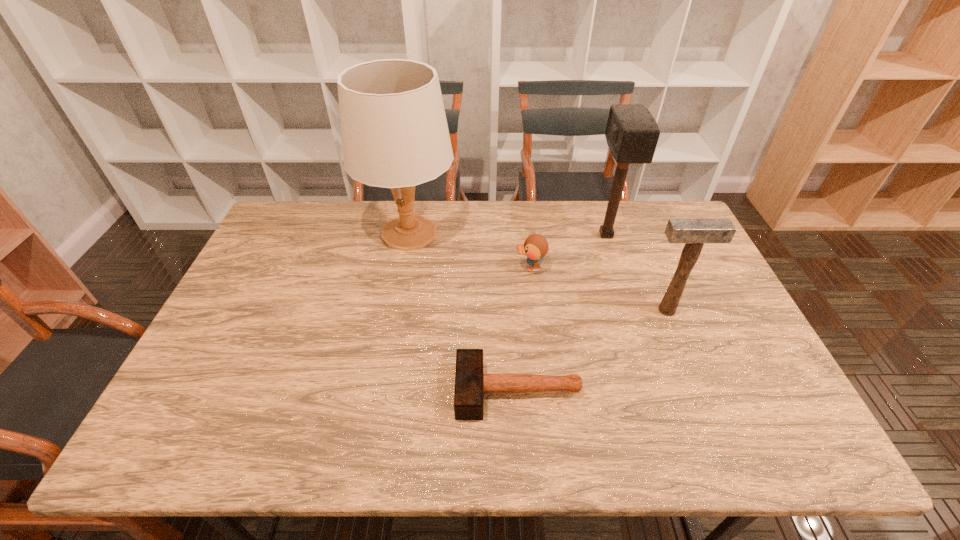
This screenshot has width=960, height=540. I want to click on the tallest object, so click(394, 131).

This screenshot has width=960, height=540. Find the location of `table lamp`. table lamp is located at coordinates (394, 131).

Find the location of a particular element. This screenshot has height=540, width=960. the farthest mallet is located at coordinates (632, 133).

Find the location of a particular element. the fourth shortest object is located at coordinates (632, 133).

This screenshot has height=540, width=960. What are the coordinates of `the second nearest object` in the screenshot? It's located at (694, 232).

Where is `the second tallest mallet`? the second tallest mallet is located at coordinates (694, 232).

Image resolution: width=960 pixels, height=540 pixels. Find the location of `the fourth tallest object`. the fourth tallest object is located at coordinates (535, 247).

Locate an element on the screen. the shortest mallet is located at coordinates (470, 383).

Where is `the shortest object`? the shortest object is located at coordinates 470,383.

This screenshot has width=960, height=540. Find the location of `free point located 0.180m on the left of the tallest object`. free point located 0.180m on the left of the tallest object is located at coordinates (308, 233).